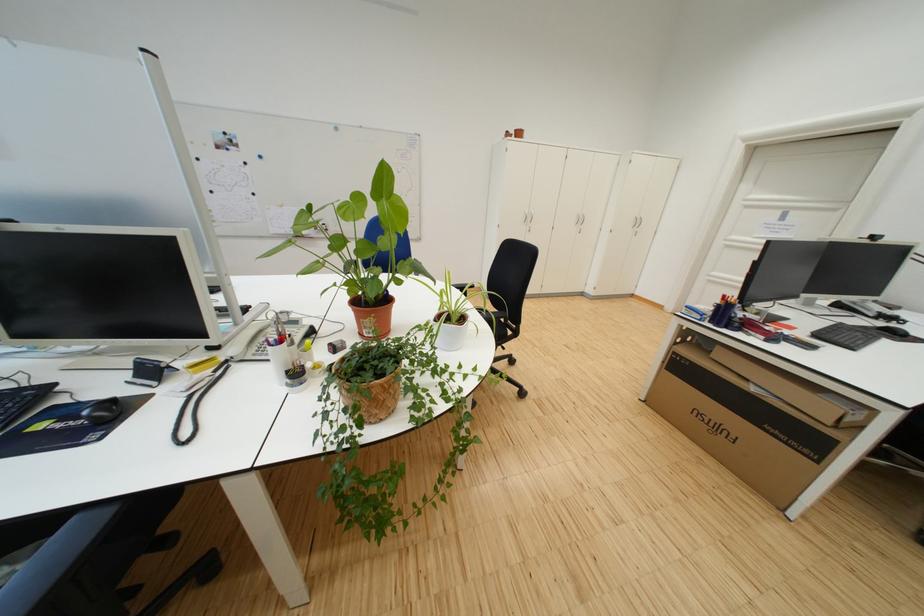
Where would you push the large cardboard box? Please return your answer as a coordinate pair (x, y).

(742, 422)